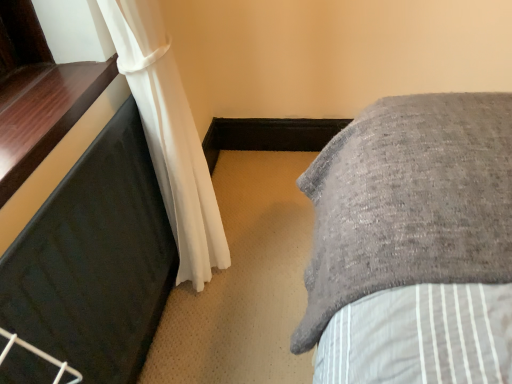
Find the location of a particular element. The height and width of the screenshot is (384, 512). vacant point above black glossy window sill at left (from a real-world perspective) is located at coordinates (37, 92).